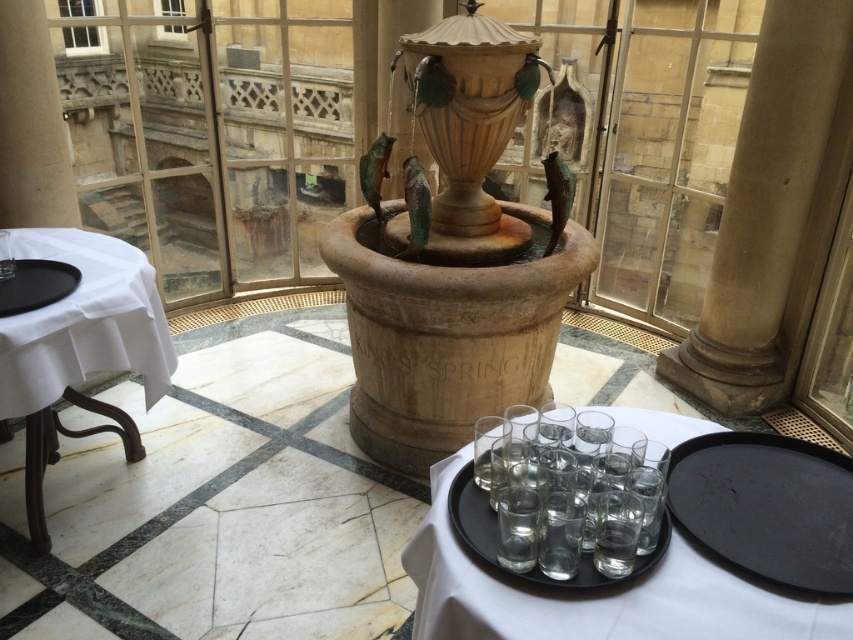
You are a guest at this elegant indoor setting and want to place a decorative item between the beige stone column at right and the black matte platter at left. Based on their positions, which side of the platter should you place it on?

The beige stone column at right is positioned on the right side of black matte platter at left, so you should place the decorative item to the right of the black matte platter at left to align with the existing arrangement.

Looking at this image, you are standing at the entrance of the room and want to locate the beige stone fountain at center. According to the coordinates provided, in which direction should you move relative to your current position?

The beige stone fountain at center is located at coordinates point (453, 259), so you should move towards the center of the room to reach it.

You are a server at the event and need to place a large silver platter on either the beige stone column at right or the black matte platter at left. Which surface can better accommodate the platter in terms of width?

The beige stone column at right might be wider than black matte platter at left, so it can better accommodate the large silver platter in terms of width.